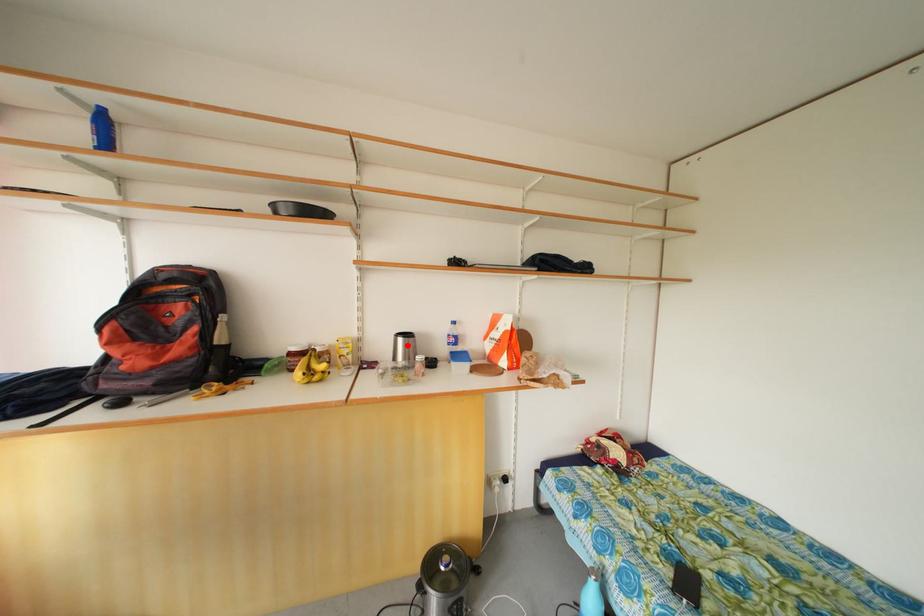
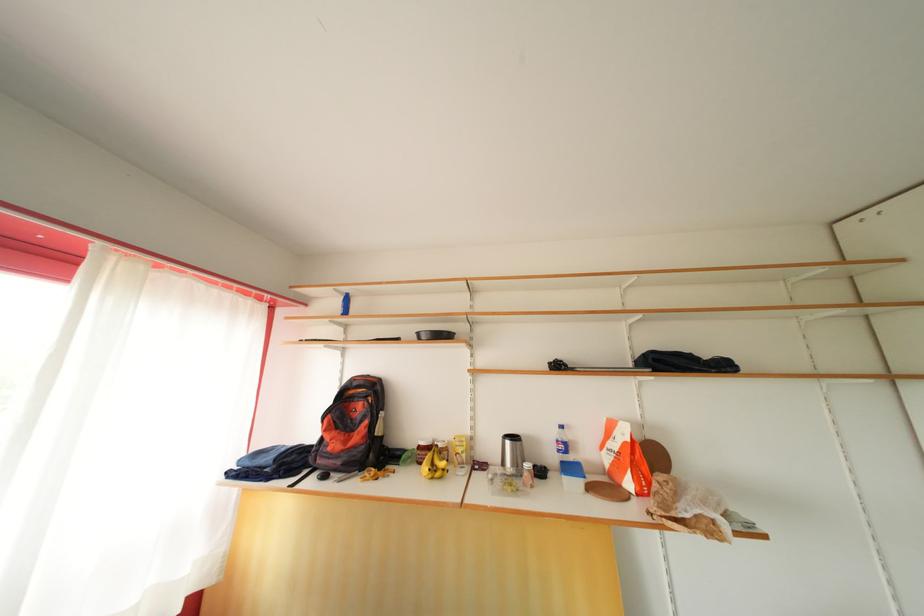
Locate, in the second image, the point that corresponds to the highlighted location in the first image.

(515, 448)